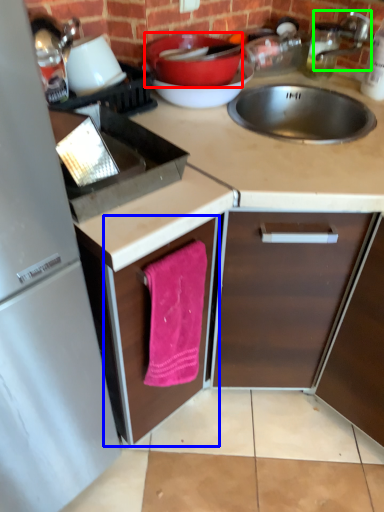
Question: Which object is positioned closest to basin (highlighted by a red box)? Select from cabinetry (highlighted by a blue box) and faucet (highlighted by a green box).

Choices:
 (A) cabinetry
 (B) faucet

Answer: (B)